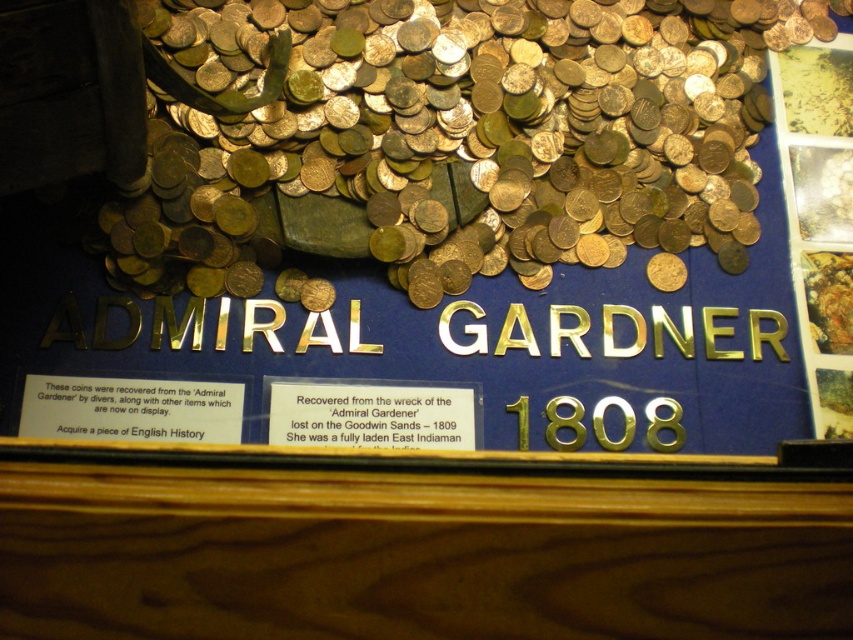
Question: Can you confirm if gold shiny coins at upper center is positioned to the right of gold metallic plaque at center?

Choices:
 (A) yes
 (B) no

Answer: (A)

Question: From the image, what is the correct spatial relationship of gold shiny coins at upper center in relation to gold metallic plaque at center?

Choices:
 (A) below
 (B) above

Answer: (B)

Question: Which of the following is the farthest from the observer?

Choices:
 (A) (207, 384)
 (B) (491, 125)
 (C) (340, 403)

Answer: (B)

Question: Considering the real-world distances, which object is closest to the matte gold plaque at lower left?

Choices:
 (A) gold shiny coins at upper center
 (B) gold metallic plaque at center

Answer: (B)

Question: Which object is positioned closest to the matte gold plaque at lower left?

Choices:
 (A) gold metallic plaque at center
 (B) gold shiny coins at upper center

Answer: (A)

Question: Can you confirm if gold shiny coins at upper center is positioned below matte gold plaque at lower left?

Choices:
 (A) yes
 (B) no

Answer: (B)